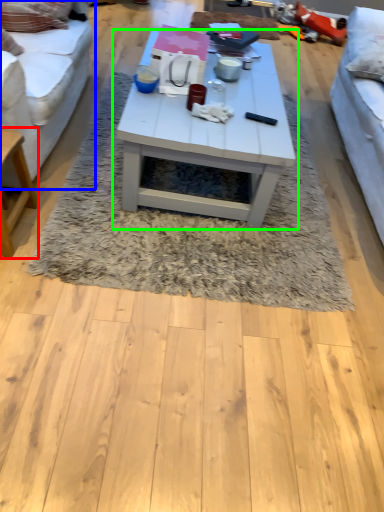
Question: Which is nearer to the table (highlighted by a red box)? studio couch (highlighted by a blue box) or coffee table (highlighted by a green box).

Choices:
 (A) studio couch
 (B) coffee table

Answer: (A)